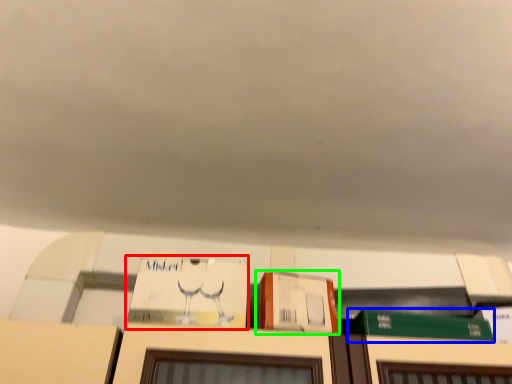
Question: Based on their relative distances, which object is nearer to book (highlighted by a red box)? Choose from book (highlighted by a blue box) and cardboard box (highlighted by a green box).

Choices:
 (A) book
 (B) cardboard box

Answer: (B)